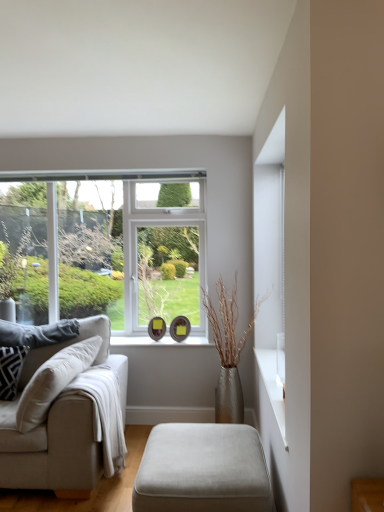
Question: Considering the relative sizes of suede ottoman at lower center and white glossy window sill at center in the image provided, is suede ottoman at lower center bigger than white glossy window sill at center?

Choices:
 (A) yes
 (B) no

Answer: (A)

Question: Is suede ottoman at lower center positioned far away from white glossy window sill at center?

Choices:
 (A) no
 (B) yes

Answer: (B)

Question: From the image's perspective, does suede ottoman at lower center appear higher than white glossy window sill at center?

Choices:
 (A) yes
 (B) no

Answer: (B)

Question: Is suede ottoman at lower center turned away from white glossy window sill at center?

Choices:
 (A) no
 (B) yes

Answer: (A)

Question: From the image's perspective, is suede ottoman at lower center located beneath white glossy window sill at center?

Choices:
 (A) no
 (B) yes

Answer: (B)

Question: Can you confirm if suede ottoman at lower center is shorter than white glossy window sill at center?

Choices:
 (A) yes
 (B) no

Answer: (B)

Question: From the image's perspective, is patterned fabric pillow on the left, the first pillow viewed from the front, on top of gray fabric pillow at left, which is the 1th pillow in back-to-front order?

Choices:
 (A) no
 (B) yes

Answer: (A)

Question: From a real-world perspective, is patterned fabric pillow on the left, the first pillow viewed from the front, physically below gray fabric pillow at left, the 2th pillow in the front-to-back sequence?

Choices:
 (A) no
 (B) yes

Answer: (B)

Question: Is patterned fabric pillow on the left, which is the second pillow from back to front, in front of gray fabric pillow at left, the 2th pillow in the front-to-back sequence?

Choices:
 (A) no
 (B) yes

Answer: (B)

Question: Can you confirm if patterned fabric pillow on the left, which is the second pillow from back to front, is shorter than gray fabric pillow at left, the 2th pillow in the front-to-back sequence?

Choices:
 (A) yes
 (B) no

Answer: (B)

Question: From a real-world perspective, is patterned fabric pillow on the left, the first pillow viewed from the front, positioned over gray fabric pillow at left, which is the 1th pillow in back-to-front order, based on gravity?

Choices:
 (A) no
 (B) yes

Answer: (A)

Question: Is patterned fabric pillow on the left, the first pillow viewed from the front, to the left of gray fabric pillow at left, which is the 1th pillow in back-to-front order, from the viewer's perspective?

Choices:
 (A) yes
 (B) no

Answer: (A)

Question: Is beige fabric couch at left positioned with its back to suede ottoman at lower center?

Choices:
 (A) yes
 (B) no

Answer: (B)